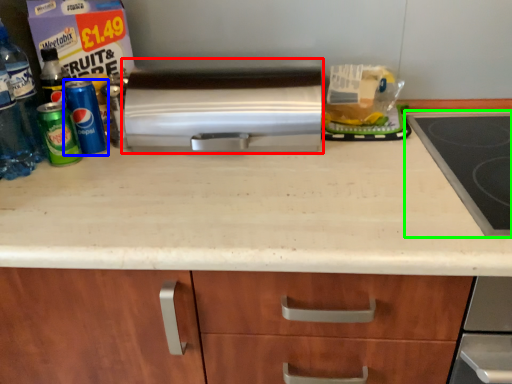
Question: Estimate the real-world distances between objects in this image. Which object is farther from kitchen appliance (highlighted by a red box), beverage (highlighted by a blue box) or gas stove (highlighted by a green box)?

Choices:
 (A) beverage
 (B) gas stove

Answer: (B)